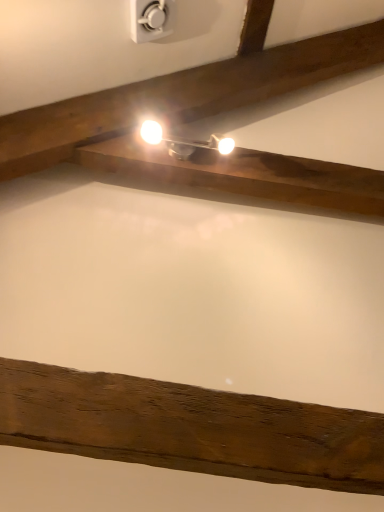
Question: Considering the positions of white glossy light fixture at upper center and white plastic power plugs and sockets at upper center in the image, is white glossy light fixture at upper center bigger or smaller than white plastic power plugs and sockets at upper center?

Choices:
 (A) big
 (B) small

Answer: (B)

Question: Is white glossy light fixture at upper center in front of or behind white plastic power plugs and sockets at upper center in the image?

Choices:
 (A) behind
 (B) front

Answer: (A)

Question: Considering the positions of white glossy light fixture at upper center and white plastic power plugs and sockets at upper center in the image, is white glossy light fixture at upper center wider or thinner than white plastic power plugs and sockets at upper center?

Choices:
 (A) thin
 (B) wide

Answer: (B)

Question: Considering the positions of point (145, 29) and point (203, 141), is point (145, 29) closer or farther from the camera than point (203, 141)?

Choices:
 (A) farther
 (B) closer

Answer: (A)

Question: In terms of size, does white plastic power plugs and sockets at upper center appear bigger or smaller than white glossy light fixture at upper center?

Choices:
 (A) small
 (B) big

Answer: (B)

Question: Visually, is white plastic power plugs and sockets at upper center positioned to the left or to the right of white glossy light fixture at upper center?

Choices:
 (A) left
 (B) right

Answer: (A)

Question: Would you say white plastic power plugs and sockets at upper center is inside or outside white glossy light fixture at upper center?

Choices:
 (A) inside
 (B) outside

Answer: (B)